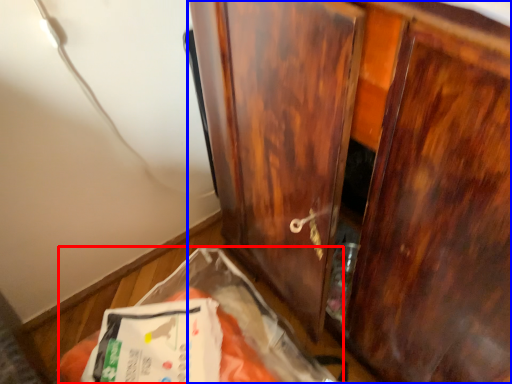
Question: Which of the following is the farthest to the observer, waste (highlighted by a red box) or cupboard (highlighted by a blue box)?

Choices:
 (A) waste
 (B) cupboard

Answer: (A)